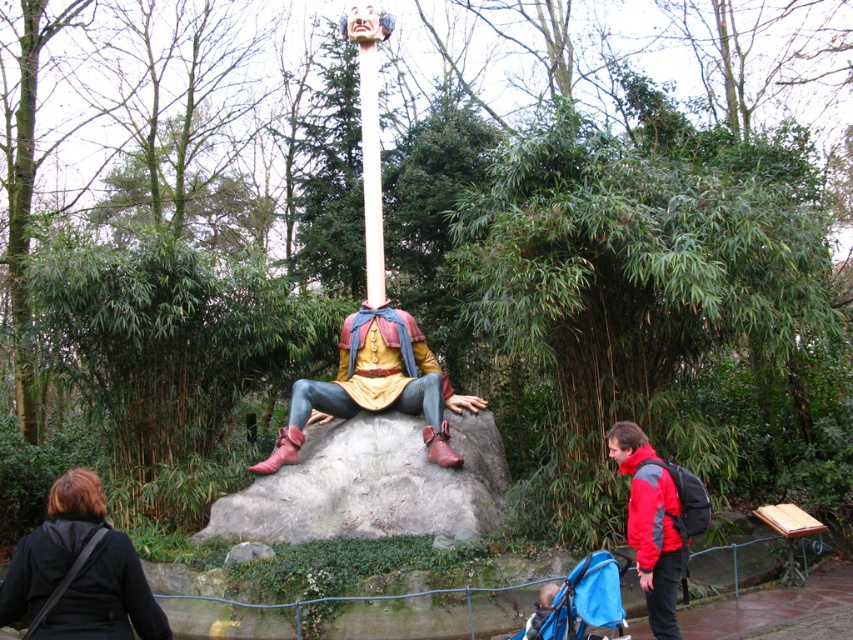
You are standing in the park and see the whimsical statue. There is a red jacket at lower right. Where exactly is the red jacket located in relation to the statue?

The red jacket at lower right is located at coordinates point (x=650, y=524) relative to the statue.

You are standing in the park and see the red jacket at lower right and the white smooth pole at center. Which object is positioned more to the east side of the park?

The white smooth pole at center is positioned more to the east side of the park because the red jacket at lower right is to the right of it.

You are a maintenance worker checking the statue in the park. You need to determine if the white smooth pole at center is attached to the matte painted wood figure at center. Based on their positions, can you confirm if the pole is part of the figure?

The matte painted wood figure at center is below the white smooth pole at center, which indicates that the pole is likely attached to the figure as part of the statue.